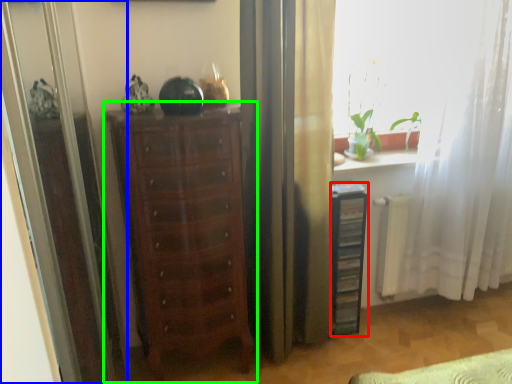
Question: Based on their relative distances, which object is farther from file cabinet (highlighted by a red box)? Choose from screen door (highlighted by a blue box) and chest of drawers (highlighted by a green box).

Choices:
 (A) screen door
 (B) chest of drawers

Answer: (A)